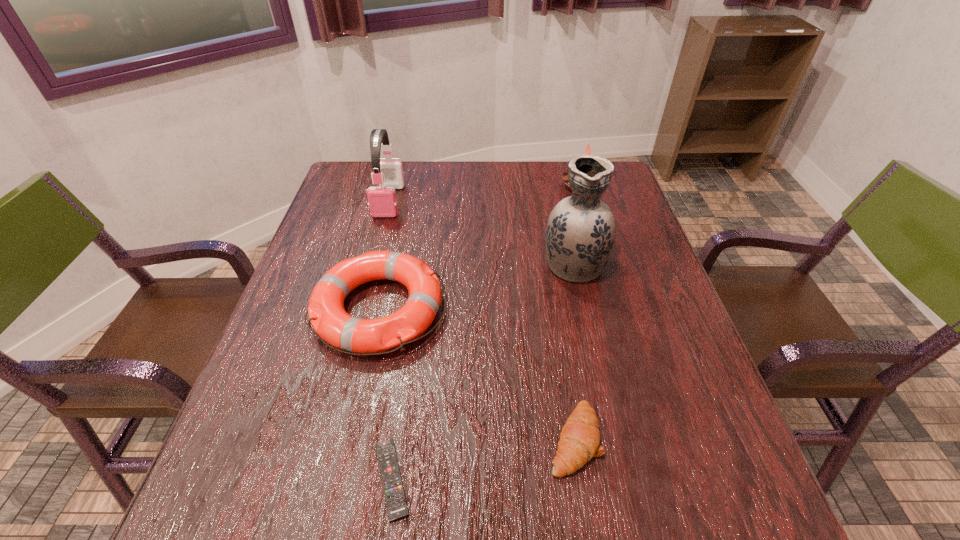
This screenshot has height=540, width=960. I want to click on free spot between the tallest object and the earphone, so click(481, 232).

Where is `vacant space that's between the second tallest object and the third tallest object`? vacant space that's between the second tallest object and the third tallest object is located at coordinates (485, 193).

You are a GUI agent. You are given a task and a screenshot of the screen. Output one action in this format:
    pyautogui.click(x=<x>, y=<y>)
    Task: Click on the free space between the third tallest object and the life buoy
    The width and height of the screenshot is (960, 540).
    Given the screenshot: What is the action you would take?
    pyautogui.click(x=481, y=247)

Where is `vacant area that lies between the crescent roll and the shortest object`? The width and height of the screenshot is (960, 540). vacant area that lies between the crescent roll and the shortest object is located at coordinates (483, 459).

Where is `free area in between the fourth tallest object and the remote control`? This screenshot has height=540, width=960. free area in between the fourth tallest object and the remote control is located at coordinates (386, 394).

Where is `vacant region between the life buoy and the vase`? This screenshot has height=540, width=960. vacant region between the life buoy and the vase is located at coordinates (476, 286).

Where is `unoccupied area between the vase and the shortest object`? The width and height of the screenshot is (960, 540). unoccupied area between the vase and the shortest object is located at coordinates (483, 371).

Identify which object is located as the fourth nearest to the remote control. Please provide its 2D coordinates. Your answer should be formatted as a tuple, i.e. [(x, y)], where the tuple contains the x and y coordinates of a point satisfying the conditions above.

[(382, 201)]

Point out which object is positioned as the fifth nearest to the life buoy. Please provide its 2D coordinates. Your answer should be formatted as a tuple, i.e. [(x, y)], where the tuple contains the x and y coordinates of a point satisfying the conditions above.

[(564, 176)]

Image resolution: width=960 pixels, height=540 pixels. I want to click on free space in the image that satisfies the following two spatial constraints: 1. on the outer surface of the third shortest object; 2. on the right side of the fifth shortest object, so click(361, 309).